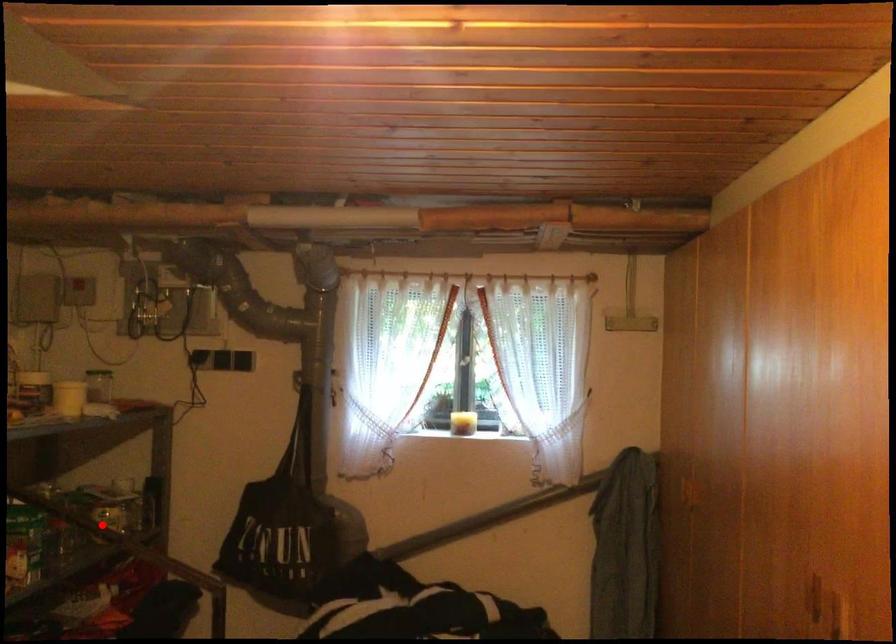
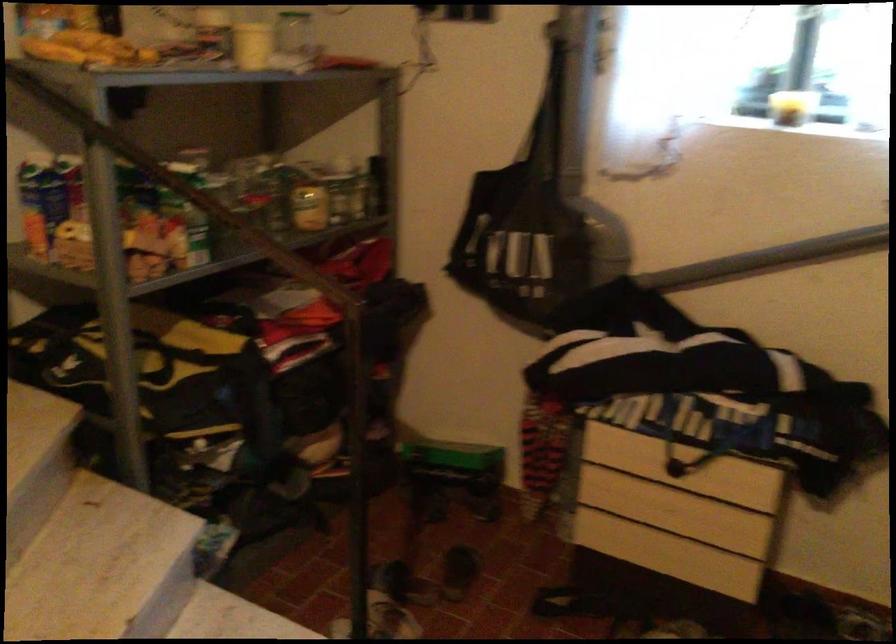
The point at the highlighted location is marked in the first image. Where is the corresponding point in the second image?

(309, 205)